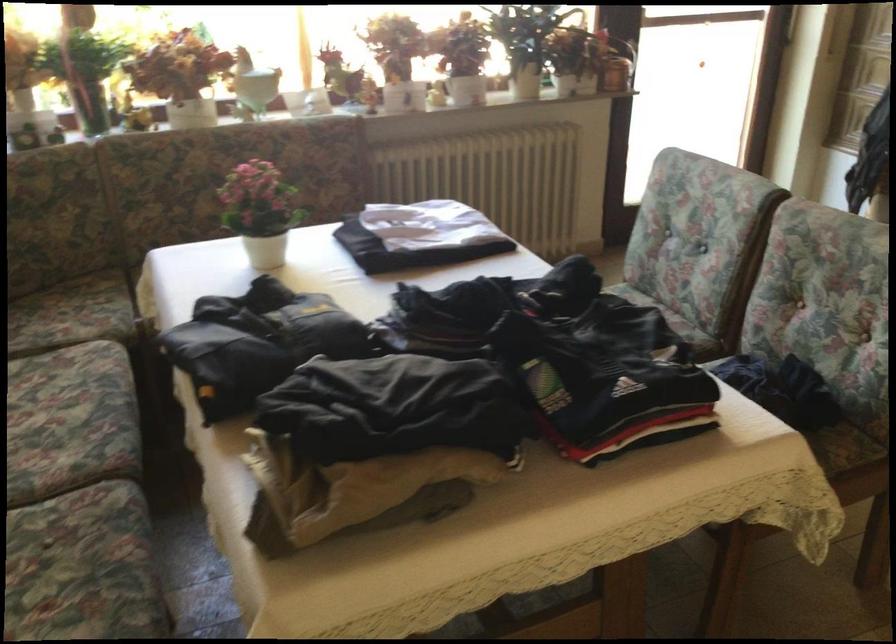
The height and width of the screenshot is (644, 896). In order to click on sofa sitting surface in this screenshot , I will do `click(73, 299)`.